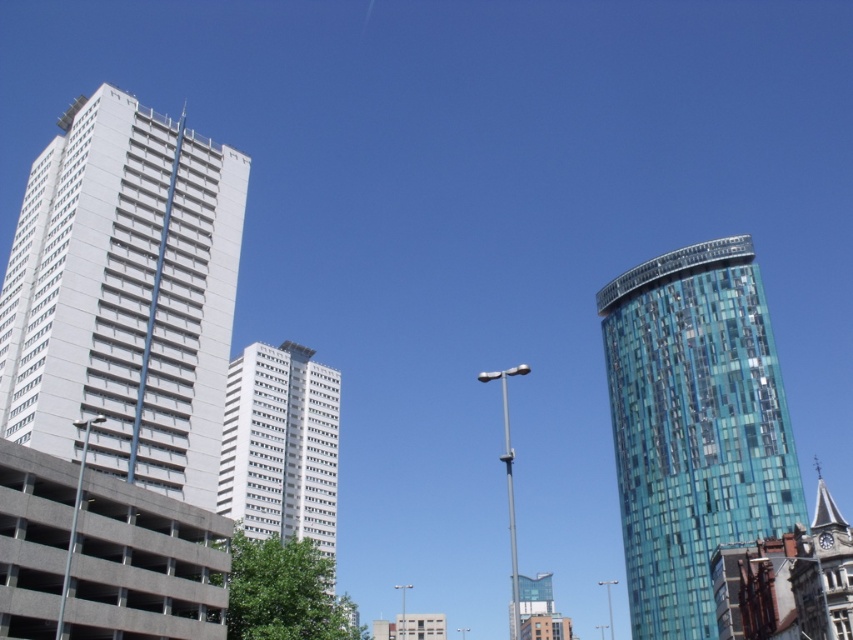
Can you confirm if white smooth building at left is smaller than blue glassy tower at right?

Yes.

Between white smooth building at left and blue glassy tower at right, which one has more height?

blue glassy tower at right

Is point (215, 352) positioned in front of point (650, 445)?

Yes, it is in front of point (650, 445).

The image size is (853, 640). I want to click on white smooth building at left, so click(125, 296).

Is blue glassy tower at right shorter than white glass building at center?

In fact, blue glassy tower at right may be taller than white glass building at center.

This screenshot has width=853, height=640. I want to click on blue glassy tower at right, so click(x=693, y=426).

Which is behind, point (755, 419) or point (328, 372)?

The point (328, 372) is more distant.

Find the location of a particular element. blue glassy tower at right is located at coordinates (693, 426).

Between point (90, 120) and point (277, 452), which one is positioned in front?

Positioned in front is point (90, 120).

Image resolution: width=853 pixels, height=640 pixels. What do you see at coordinates (125, 296) in the screenshot?
I see `white smooth building at left` at bounding box center [125, 296].

At what (x,y) coordinates should I click in order to perform the action: click on white smooth building at left. Please return your answer as a coordinate pair (x, y). This screenshot has width=853, height=640. Looking at the image, I should click on (125, 296).